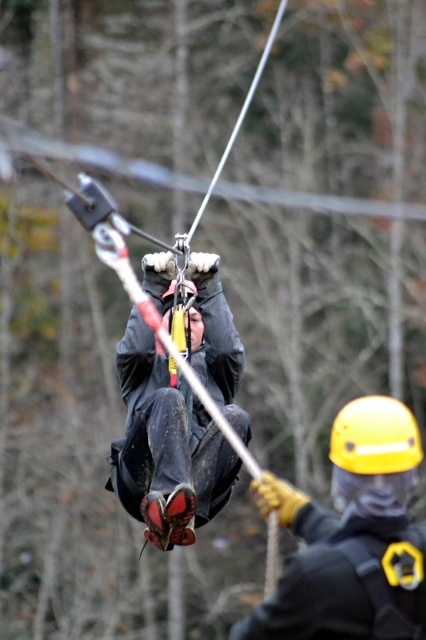
Question: Can you confirm if yellow hard hat at center is positioned below matte black jacket at center?

Choices:
 (A) no
 (B) yes

Answer: (B)

Question: Among these objects, which one is farthest from the camera?

Choices:
 (A) yellow hard hat at center
 (B) matte black jacket at center

Answer: (B)

Question: Is yellow hard hat at center positioned before matte black jacket at center?

Choices:
 (A) no
 (B) yes

Answer: (B)

Question: Does yellow hard hat at center have a lesser width compared to matte black jacket at center?

Choices:
 (A) yes
 (B) no

Answer: (B)

Question: Which of the following is the closest to the observer?

Choices:
 (A) (273, 637)
 (B) (201, 515)

Answer: (A)